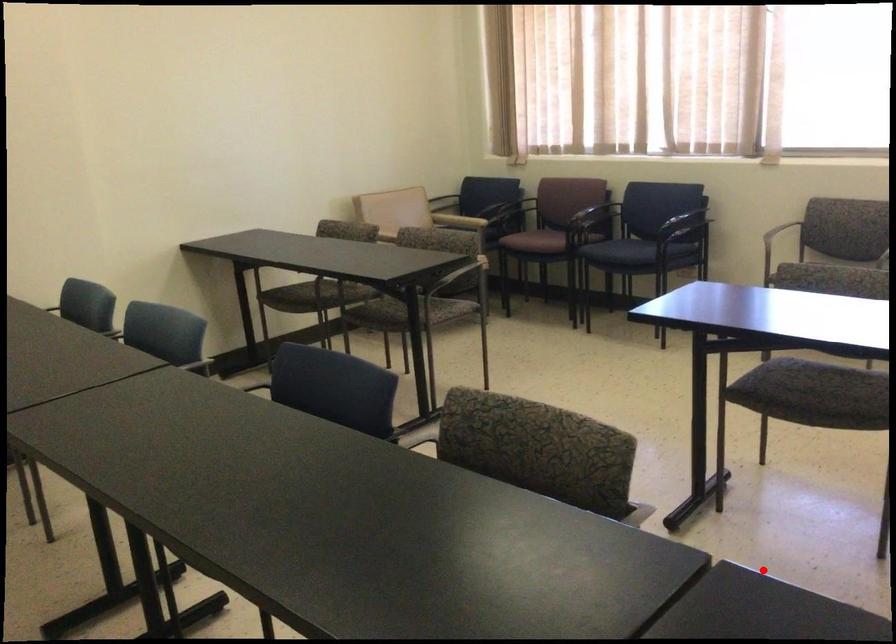
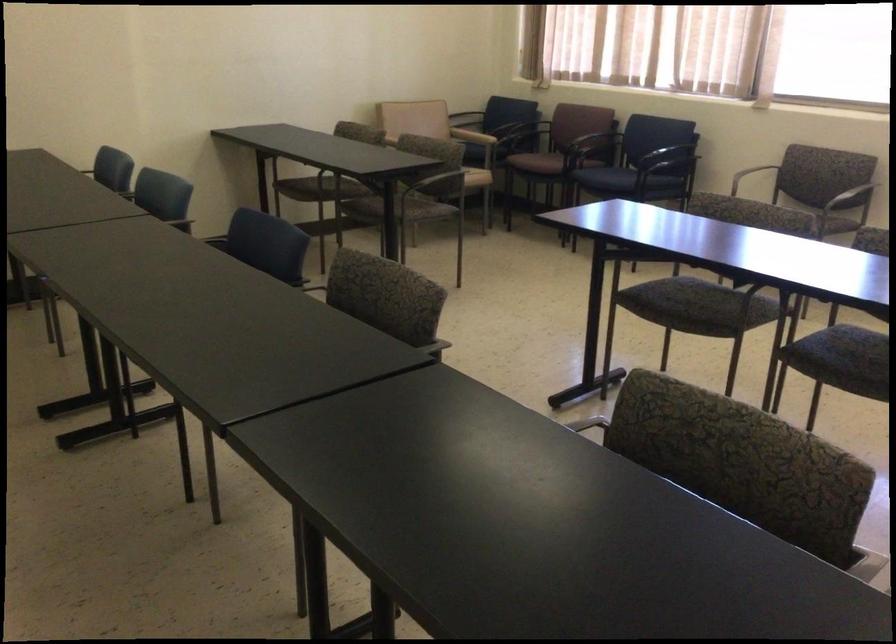
Question: I am providing you with two images of the same scene from different viewpoints. A red point is marked on the first image. Can you still see the location of the red point in image 2?

Choices:
 (A) Yes
 (B) No

Answer: (B)